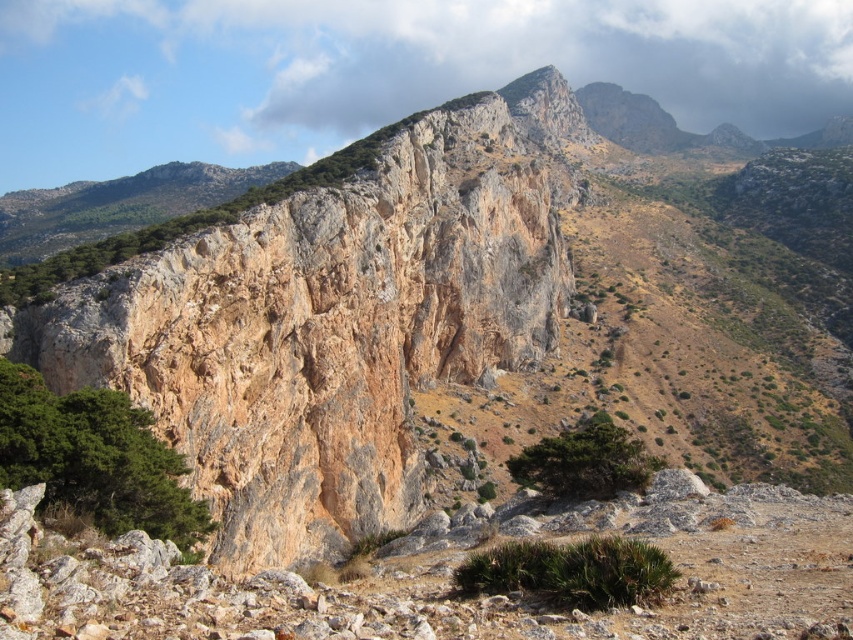
Is green leafy tree at lower left closer to the viewer compared to green rough textured tree at center?

Yes, green leafy tree at lower left is closer to the viewer.

Does green leafy tree at lower left appear on the right side of green rough textured tree at center?

No, green leafy tree at lower left is not to the right of green rough textured tree at center.

Who is more distant from viewer, [36,460] or [553,480]?

The point [553,480] is more distant.

This screenshot has height=640, width=853. Find the location of `green leafy tree at lower left`. green leafy tree at lower left is located at coordinates (94, 458).